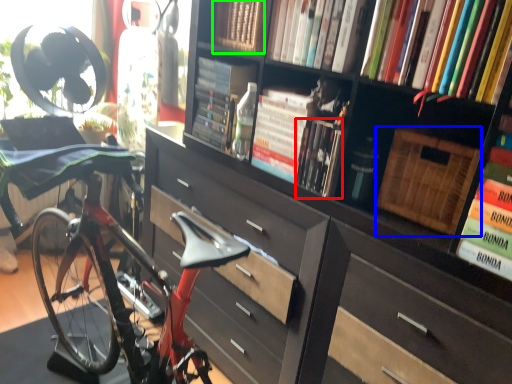
Question: Considering the real-world distances, which object is farthest from book (highlighted by a red box)? basket (highlighted by a blue box) or book (highlighted by a green box)?

Choices:
 (A) basket
 (B) book

Answer: (B)